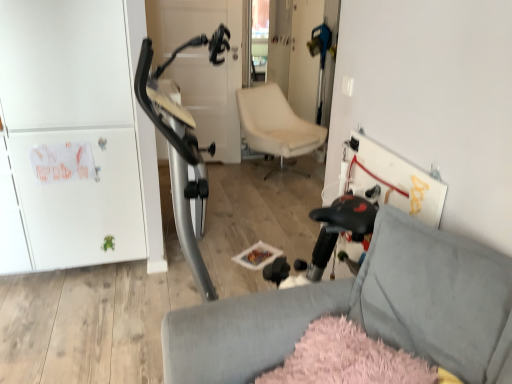
What do you see at coordinates (71, 129) in the screenshot?
I see `white matte cabinet at left` at bounding box center [71, 129].

The height and width of the screenshot is (384, 512). Describe the element at coordinates (364, 310) in the screenshot. I see `soft gray fabric chair at lower right, the 1th chair from the bottom` at that location.

I want to click on white matte cabinet at left, so click(71, 129).

Considering the sizes of soft gray fabric chair at lower right, which appears as the second chair when viewed from the back, and white matte cabinet at left in the image, is soft gray fabric chair at lower right, which appears as the second chair when viewed from the back, taller or shorter than white matte cabinet at left?

soft gray fabric chair at lower right, which appears as the second chair when viewed from the back, is shorter than white matte cabinet at left.

Is soft gray fabric chair at lower right, the 1th chair from the bottom, facing away from white matte cabinet at left?

No, white matte cabinet at left is not at the back of soft gray fabric chair at lower right, the 1th chair from the bottom.

At what (x,y) coordinates should I click in order to perform the action: click on fridge above the soft gray fabric chair at lower right, the 1th chair from the bottom (from the image's perspective). Please return your answer as a coordinate pair (x, y). Looking at the image, I should click on (71, 129).

Which of these two, soft gray fabric chair at lower right, which appears as the second chair when viewed from the back, or white matte cabinet at left, is bigger?

white matte cabinet at left.

Could you measure the distance between beige leather chair at center, marked as the second chair in a front-to-back arrangement, and white matte cabinet at left?

The distance of beige leather chair at center, marked as the second chair in a front-to-back arrangement, from white matte cabinet at left is 2.00 meters.

Does beige leather chair at center, arranged as the 1th chair when viewed from the back, have a greater height compared to white matte cabinet at left?

No, beige leather chair at center, arranged as the 1th chair when viewed from the back, is not taller than white matte cabinet at left.

In the image, is beige leather chair at center, arranged as the 1th chair when viewed from the back, on the left side or the right side of white matte cabinet at left?

From the image, it's evident that beige leather chair at center, arranged as the 1th chair when viewed from the back, is to the right of white matte cabinet at left.

From a real-world perspective, between beige leather chair at center, marked as the second chair in a front-to-back arrangement, and white matte cabinet at left, who is vertically lower?

In real-world perspective, beige leather chair at center, marked as the second chair in a front-to-back arrangement, is lower.

How far apart are white matte cabinet at left and soft gray fabric chair at lower right, which is the first chair in front-to-back order?

white matte cabinet at left is 4.74 feet away from soft gray fabric chair at lower right, which is the first chair in front-to-back order.

Is white matte cabinet at left not near soft gray fabric chair at lower right, which appears as the second chair when viewed from the back?

Yes, white matte cabinet at left is far from soft gray fabric chair at lower right, which appears as the second chair when viewed from the back.

In the scene shown: Does white matte cabinet at left have a lesser width compared to soft gray fabric chair at lower right, the 1th chair from the bottom?

Correct, the width of white matte cabinet at left is less than that of soft gray fabric chair at lower right, the 1th chair from the bottom.

Is soft gray fabric chair at lower right, which appears as the second chair when viewed from the back, surrounded by white matte cabinet at left?

No, soft gray fabric chair at lower right, which appears as the second chair when viewed from the back, is located outside of white matte cabinet at left.

Considering their positions, is soft gray fabric chair at lower right, which is the second chair from top to bottom, located in front of or behind beige leather chair at center, arranged as the 1th chair when viewed from the back?

Visually, soft gray fabric chair at lower right, which is the second chair from top to bottom, is located in front of beige leather chair at center, arranged as the 1th chair when viewed from the back.

Identify the location of chair located in front of the beige leather chair at center, which is the first chair in top-to-bottom order. This screenshot has width=512, height=384. (364, 310).

How many degrees apart are the facing directions of soft gray fabric chair at lower right, which is the second chair from top to bottom, and beige leather chair at center, arranged as the 1th chair when viewed from the back?

soft gray fabric chair at lower right, which is the second chair from top to bottom, and beige leather chair at center, arranged as the 1th chair when viewed from the back, are facing 99 degrees away from each other.

Looking at this image, is soft gray fabric chair at lower right, which appears as the second chair when viewed from the back, wider or thinner than beige leather chair at center, arranged as the 1th chair when viewed from the back?

Clearly, soft gray fabric chair at lower right, which appears as the second chair when viewed from the back, has more width compared to beige leather chair at center, arranged as the 1th chair when viewed from the back.

Does white matte cabinet at left touch beige leather chair at center, the second chair in the bottom-to-top sequence?

They are not placed beside each other.

From a real-world perspective, between white matte cabinet at left and beige leather chair at center, the second chair in the bottom-to-top sequence, who is vertically higher?

In real-world perspective, white matte cabinet at left is above.

In terms of height, does white matte cabinet at left look taller or shorter compared to beige leather chair at center, arranged as the 1th chair when viewed from the back?

In the image, white matte cabinet at left appears to be taller than beige leather chair at center, arranged as the 1th chair when viewed from the back.

How many degrees apart are the facing directions of beige leather chair at center, the second chair in the bottom-to-top sequence, and soft gray fabric chair at lower right, which appears as the second chair when viewed from the back?

The facing directions of beige leather chair at center, the second chair in the bottom-to-top sequence, and soft gray fabric chair at lower right, which appears as the second chair when viewed from the back, are 99 degrees apart.

Does point (256, 122) lie in front of point (456, 371)?

No, (256, 122) is behind (456, 371).

The image size is (512, 384). Identify the location of chair that is on the left side of beige leather chair at center, which is the first chair in top-to-bottom order. (364, 310).

Between beige leather chair at center, marked as the second chair in a front-to-back arrangement, and soft gray fabric chair at lower right, the 1th chair from the bottom, which one appears on the right side from the viewer's perspective?

From the viewer's perspective, beige leather chair at center, marked as the second chair in a front-to-back arrangement, appears more on the right side.

Image resolution: width=512 pixels, height=384 pixels. Identify the location of fridge that is above the soft gray fabric chair at lower right, which appears as the second chair when viewed from the back (from the image's perspective). (71, 129).

Which chair is the 2nd one when counting from the right side of the white matte cabinet at left? Please provide its 2D coordinates.

[(276, 125)]

From the image, which object appears to be nearer to soft gray fabric chair at lower right, which appears as the second chair when viewed from the back, white matte cabinet at left or beige leather chair at center, the second chair in the bottom-to-top sequence?

Based on the image, white matte cabinet at left appears to be nearer to soft gray fabric chair at lower right, which appears as the second chair when viewed from the back.

Which object lies further to the anchor point white matte cabinet at left, beige leather chair at center, the second chair in the bottom-to-top sequence, or soft gray fabric chair at lower right, which is the second chair from top to bottom?

beige leather chair at center, the second chair in the bottom-to-top sequence, lies further to white matte cabinet at left than the other object.

Based on their spatial positions, is soft gray fabric chair at lower right, which is the first chair in front-to-back order, or white matte cabinet at left closer to beige leather chair at center, arranged as the 1th chair when viewed from the back?

The object closer to beige leather chair at center, arranged as the 1th chair when viewed from the back, is white matte cabinet at left.

Estimate the real-world distances between objects in this image. Which object is closer to white matte cabinet at left, soft gray fabric chair at lower right, the 1th chair from the bottom, or beige leather chair at center, arranged as the 1th chair when viewed from the back?

Among the two, soft gray fabric chair at lower right, the 1th chair from the bottom, is located nearer to white matte cabinet at left.

When comparing their distances from beige leather chair at center, marked as the second chair in a front-to-back arrangement, does white matte cabinet at left or soft gray fabric chair at lower right, which is the second chair from top to bottom, seem closer?

Based on the image, white matte cabinet at left appears to be nearer to beige leather chair at center, marked as the second chair in a front-to-back arrangement.

Considering their positions, is beige leather chair at center, marked as the second chair in a front-to-back arrangement, positioned further to soft gray fabric chair at lower right, which is the second chair from top to bottom, than white matte cabinet at left?

beige leather chair at center, marked as the second chair in a front-to-back arrangement.

Locate an element on the screen. This screenshot has height=384, width=512. fridge located between soft gray fabric chair at lower right, which appears as the second chair when viewed from the back, and beige leather chair at center, arranged as the 1th chair when viewed from the back, in the depth direction is located at coordinates (71, 129).